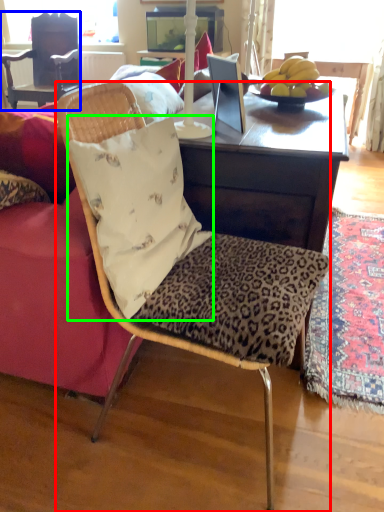
Question: Which is farther away from chair (highlighted by a red box)? chair (highlighted by a blue box) or pillow (highlighted by a green box)?

Choices:
 (A) chair
 (B) pillow

Answer: (A)